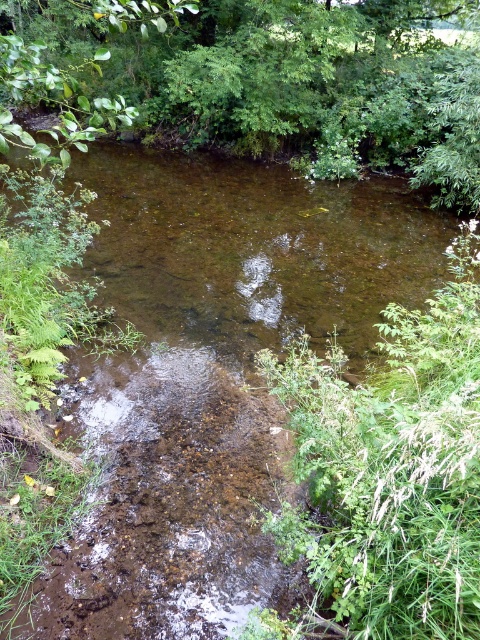
Question: Considering the relative positions of green leafy tree at upper center and brown muddy stream at center in the image provided, where is green leafy tree at upper center located with respect to brown muddy stream at center?

Choices:
 (A) right
 (B) left

Answer: (B)

Question: Can you confirm if green leafy tree at upper center is positioned above brown muddy stream at center?

Choices:
 (A) yes
 (B) no

Answer: (A)

Question: Is green leafy tree at upper center wider than brown muddy stream at center?

Choices:
 (A) yes
 (B) no

Answer: (B)

Question: Among these points, which one is nearest to the camera?

Choices:
 (A) 195,461
 (B) 476,193

Answer: (A)